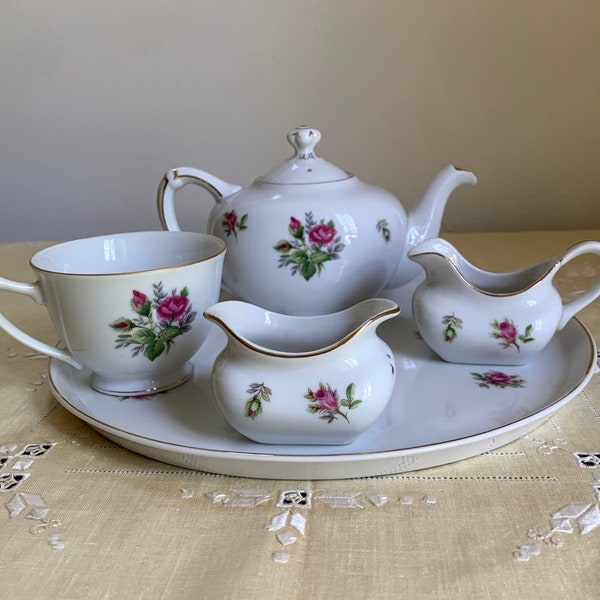
This screenshot has width=600, height=600. In order to click on plate in this screenshot , I will do `click(444, 417)`.